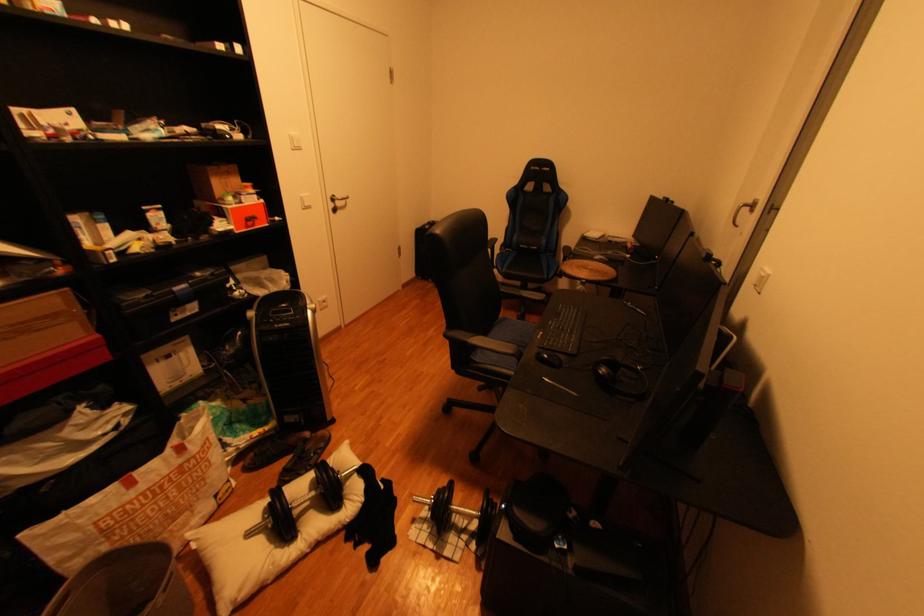
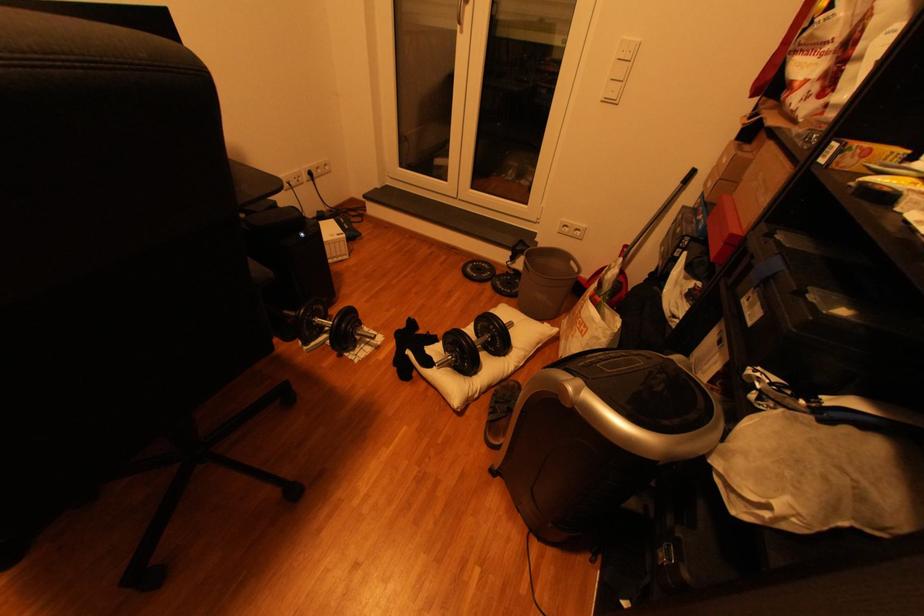
Find the pixel in the second image that matches point (365, 476) in the first image.

(445, 361)